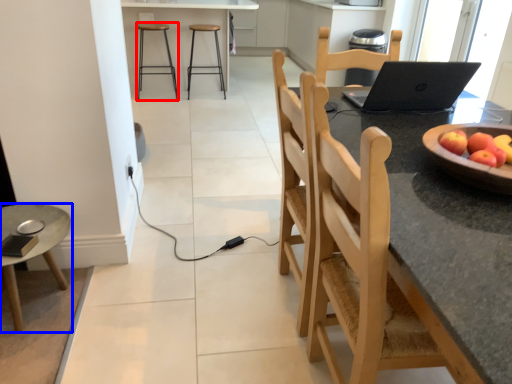
Question: Which point is closer to the camera, stool (highlighted by a red box) or desk (highlighted by a blue box)?

Choices:
 (A) stool
 (B) desk

Answer: (B)